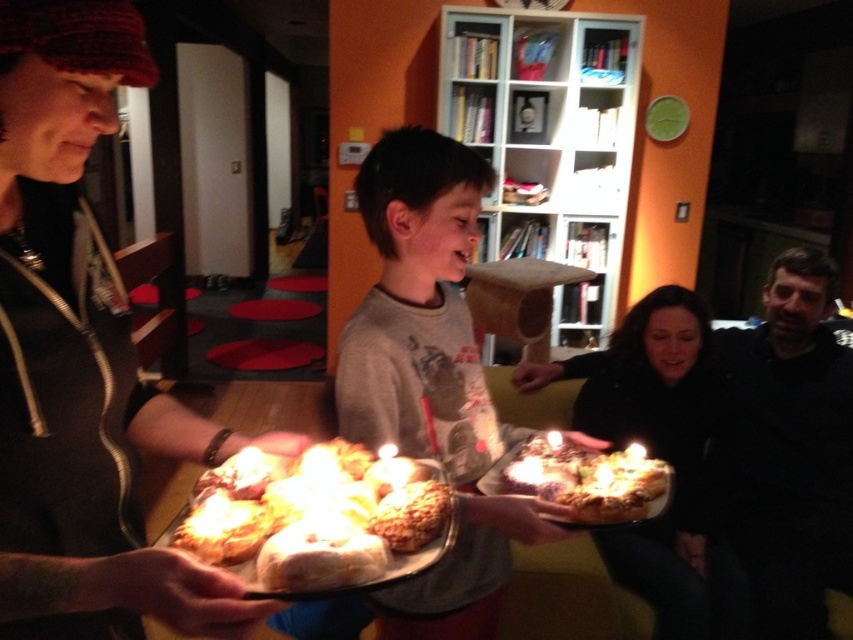
You are standing in the living room and need to hand a gift to the person wearing the gray cotton shirt at center. Based on their position, where should you walk to find them?

The gray cotton shirt at center is located at point (431, 378), so you should walk towards the coordinates (431, 378) to find the person wearing the gray cotton shirt at center.

You are standing in the living room and want to place a decorative item on the bookshelf. The bookshelf is located in the background. Which object should you move to access the bookshelf first, the black matte sweater at right or the bookshelf?

→ You should move toward the bookshelf first because it is located in the background, meaning it is further away from you than the black matte sweater at right, which is closer.

You are a guest at the party and want to place a small gift on the golden brown crusty bread at center. However, there is a dark gray sweater at lower right nearby. Which object should you place the gift on to ensure it stays visible?

The golden brown crusty bread at center is shorter than the dark gray sweater at lower right. Placing the gift on the golden brown crusty bread at center would make it more visible since it is lower and not obstructed by the taller sweater.